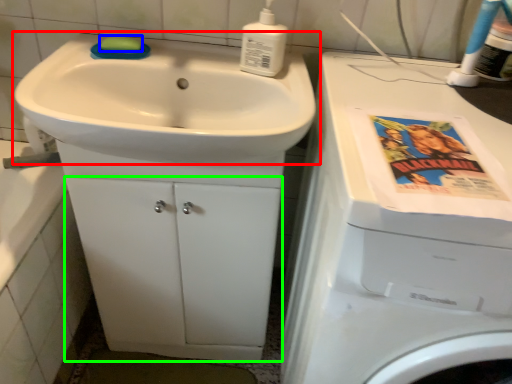
Question: Which object is positioned closest to sink (highlighted by a red box)? Select from soap (highlighted by a blue box) and drawer (highlighted by a green box).

Choices:
 (A) soap
 (B) drawer

Answer: (A)